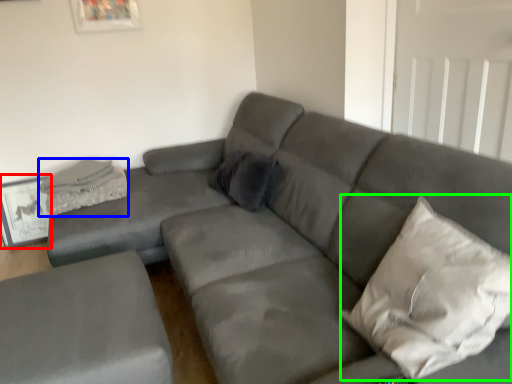
Question: Based on their relative distances, which object is farther from picture frame (highlighted by a red box)? Choose from material (highlighted by a blue box) and pillow (highlighted by a green box).

Choices:
 (A) material
 (B) pillow

Answer: (B)